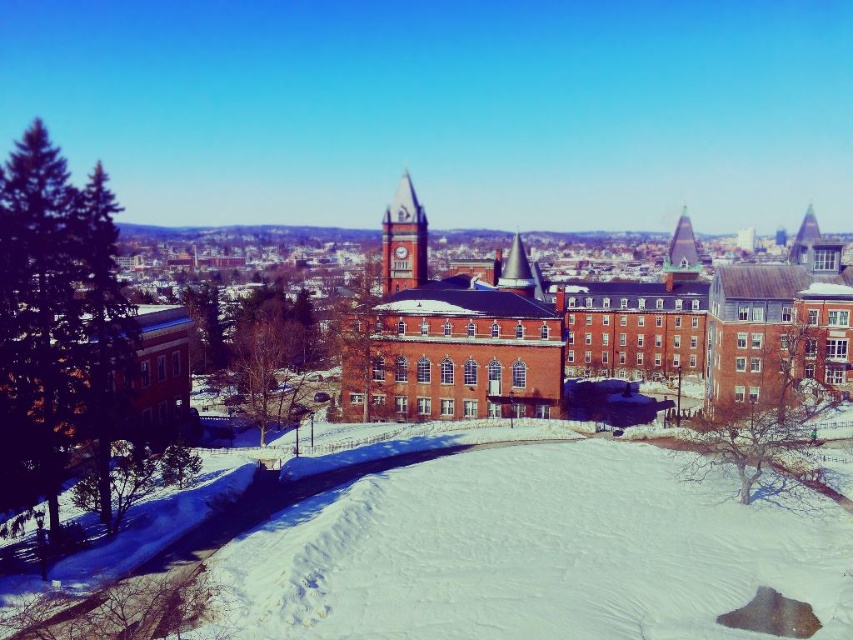
You are standing in front of the red brick building and notice two structures at the center. Which one is positioned higher up, the matte brick clock tower at center or the smooth gray spire at center?

The matte brick clock tower at center is positioned higher up than the smooth gray spire at center.

Looking at the winter scene with the red brick building and clock tower, you notice the smooth glass pyramid at upper right and the smooth gray spire at center. Which of these two structures is positioned to the right side of the other?

The smooth glass pyramid at upper right is to the right of the smooth gray spire at center.

You are standing in the winter scene and want to take a photo of the matte brick clock tower at center. If your camera can capture objects up to 500 feet away, will the tower be in focus?

The matte brick clock tower at center is 402.90 feet away from the viewer. Since the camera can focus up to 500 feet, the tower will be within range and in focus.